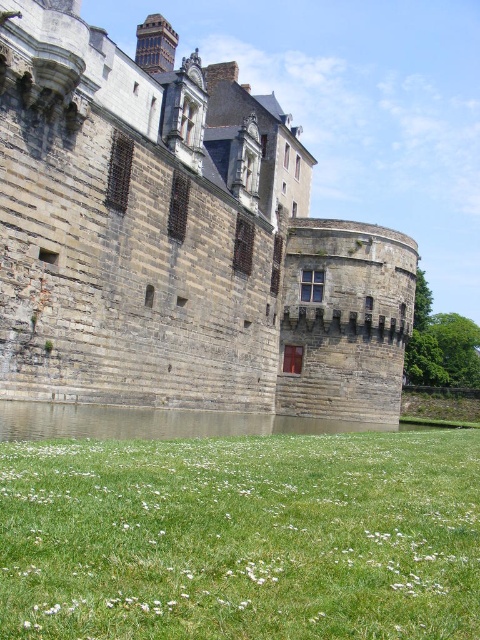
Question: Does gray stone castle at center appear on the left side of green grass at lower center?

Choices:
 (A) yes
 (B) no

Answer: (A)

Question: Can you confirm if gray stone castle at center is smaller than green grass at lower center?

Choices:
 (A) yes
 (B) no

Answer: (B)

Question: Which of the following is the farthest from the observer?

Choices:
 (A) green grass at lower center
 (B) gray stone castle at center

Answer: (B)

Question: Can you confirm if gray stone castle at center is thinner than green grass at lower center?

Choices:
 (A) yes
 (B) no

Answer: (B)

Question: Which point is farther from the camera taking this photo?

Choices:
 (A) pyautogui.click(x=247, y=554)
 (B) pyautogui.click(x=283, y=124)

Answer: (B)